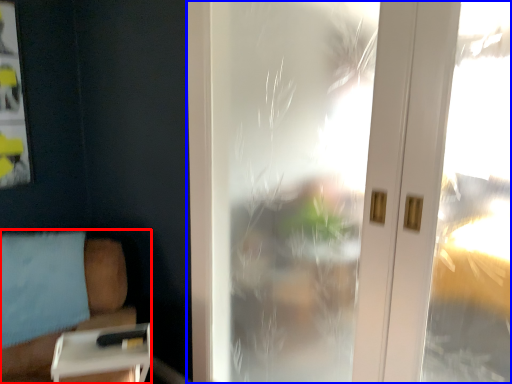
Question: Which object is closer to the camera taking this photo, furniture (highlighted by a red box) or window (highlighted by a blue box)?

Choices:
 (A) furniture
 (B) window

Answer: (A)